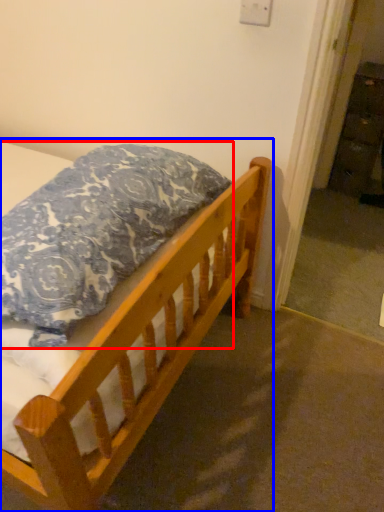
Question: Which of the following is the closest to the observer, pillow (highlighted by a red box) or bed (highlighted by a blue box)?

Choices:
 (A) pillow
 (B) bed

Answer: (A)